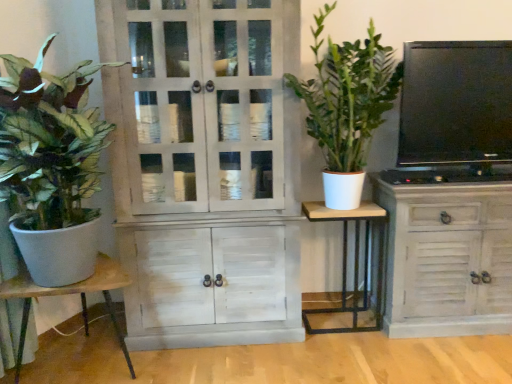
You are a GUI agent. You are given a task and a screenshot of the screen. Output one action in this format:
    pyautogui.click(x=<x>, y=<y>)
    Task: Click on the free space between white wood cabinet at center, which is counted as the 2th cabinetry, starting from the right, and wooden table at left, which is the first table from left to right
    Image resolution: width=512 pixels, height=384 pixels.
    Given the screenshot: What is the action you would take?
    pyautogui.click(x=206, y=360)